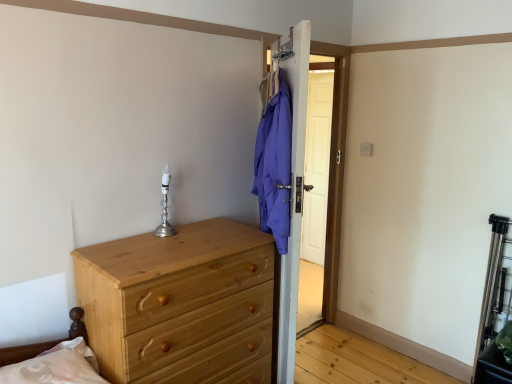
Question: Does natural wood chest of drawers at lower left have a greater height compared to brown wooden bed frame at lower left?

Choices:
 (A) yes
 (B) no

Answer: (A)

Question: From a real-world perspective, is natural wood chest of drawers at lower left below brown wooden bed frame at lower left?

Choices:
 (A) yes
 (B) no

Answer: (A)

Question: Is natural wood chest of drawers at lower left at the right side of brown wooden bed frame at lower left?

Choices:
 (A) yes
 (B) no

Answer: (A)

Question: Can we say natural wood chest of drawers at lower left lies outside brown wooden bed frame at lower left?

Choices:
 (A) yes
 (B) no

Answer: (A)

Question: Could you tell me if natural wood chest of drawers at lower left is turned towards brown wooden bed frame at lower left?

Choices:
 (A) no
 (B) yes

Answer: (A)

Question: From a real-world perspective, is natural wood chest of drawers at lower left located higher than brown wooden bed frame at lower left?

Choices:
 (A) no
 (B) yes

Answer: (A)

Question: From a real-world perspective, is brown wooden bed frame at lower left located higher than silver metallic candle holder at center?

Choices:
 (A) yes
 (B) no

Answer: (B)

Question: Can you confirm if brown wooden bed frame at lower left is thinner than silver metallic candle holder at center?

Choices:
 (A) yes
 (B) no

Answer: (B)

Question: Does brown wooden bed frame at lower left appear on the right side of silver metallic candle holder at center?

Choices:
 (A) no
 (B) yes

Answer: (A)

Question: From the image's perspective, is brown wooden bed frame at lower left above silver metallic candle holder at center?

Choices:
 (A) no
 (B) yes

Answer: (A)

Question: Is brown wooden bed frame at lower left not near silver metallic candle holder at center?

Choices:
 (A) no
 (B) yes

Answer: (A)

Question: Is brown wooden bed frame at lower left positioned behind silver metallic candle holder at center?

Choices:
 (A) no
 (B) yes

Answer: (A)

Question: Is natural wood chest of drawers at lower left at the left side of silver metallic candle holder at center?

Choices:
 (A) yes
 (B) no

Answer: (B)